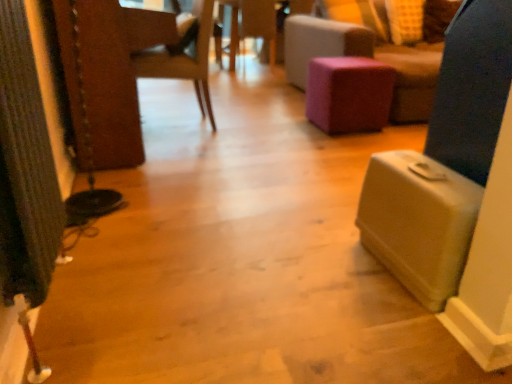
Where is `free space that is in between beige plastic suitcase at lower right and wooden chair at center`? The image size is (512, 384). free space that is in between beige plastic suitcase at lower right and wooden chair at center is located at coordinates (247, 167).